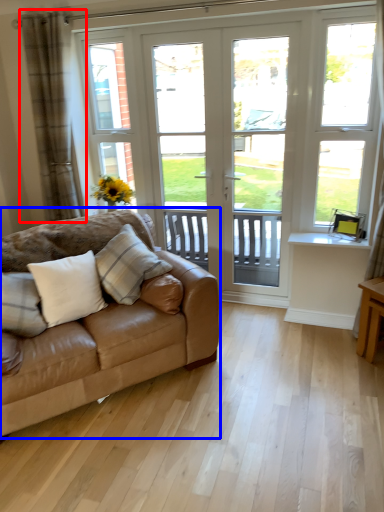
Question: Which object is further to the camera taking this photo, curtain (highlighted by a red box) or studio couch (highlighted by a blue box)?

Choices:
 (A) curtain
 (B) studio couch

Answer: (A)